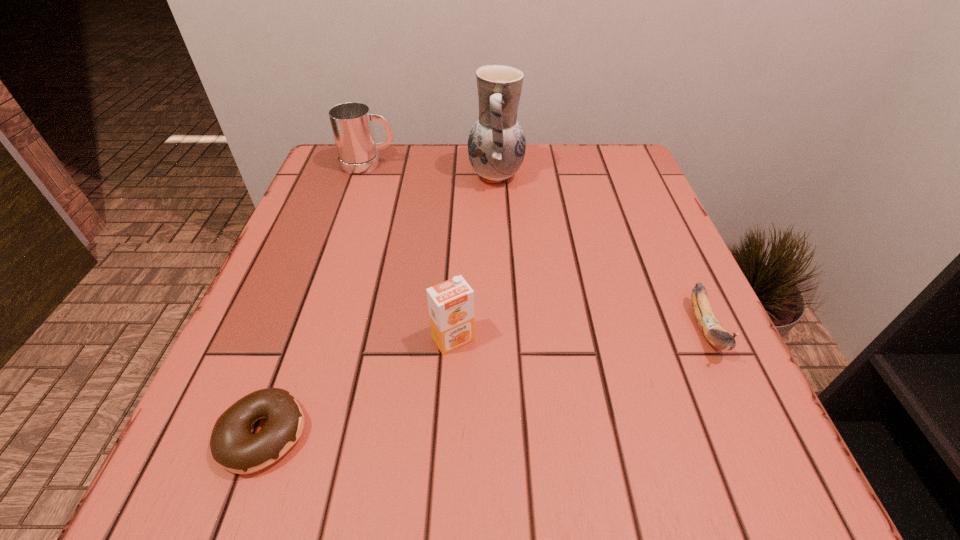
This screenshot has width=960, height=540. I want to click on vacant point located between the orange juice and the fourth tallest object, so click(x=580, y=334).

The image size is (960, 540). In order to click on free space that is in between the doughnut and the mug in this screenshot , I will do `click(316, 299)`.

Find the location of a particular element. This screenshot has height=540, width=960. vacant space that's between the doughnut and the banana is located at coordinates tap(484, 382).

I want to click on vacant area between the orange juice and the mug, so click(x=411, y=252).

Find the location of a particular element. This screenshot has width=960, height=540. empty space that is in between the banana and the tallest object is located at coordinates (601, 253).

Where is `free space between the fourth tallest object and the doughnut`? free space between the fourth tallest object and the doughnut is located at coordinates (484, 382).

This screenshot has height=540, width=960. Find the location of `unoccupied position between the nearest object and the mug`. unoccupied position between the nearest object and the mug is located at coordinates (316, 299).

Select which object is the fourth closest to the mug. Please provide its 2D coordinates. Your answer should be formatted as a tuple, i.e. [(x, y)], where the tuple contains the x and y coordinates of a point satisfying the conditions above.

[(710, 326)]

Identify which object is the second nearest to the mug. Please provide its 2D coordinates. Your answer should be formatted as a tuple, i.e. [(x, y)], where the tuple contains the x and y coordinates of a point satisfying the conditions above.

[(451, 303)]

In order to click on vacant space that satisfies the following two spatial constraints: 1. on the side of the mug with the handle; 2. on the front side of the shortest object in this screenshot , I will do `click(277, 435)`.